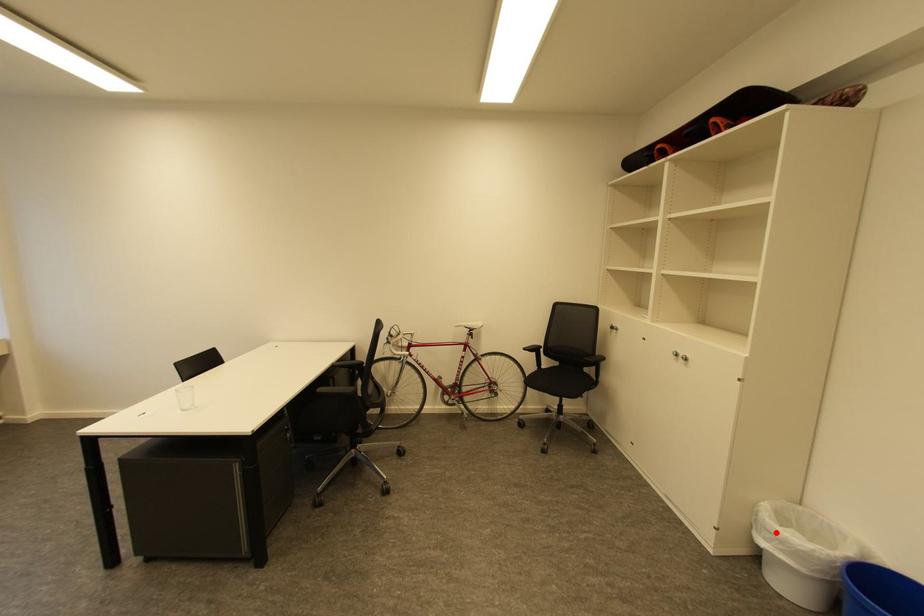
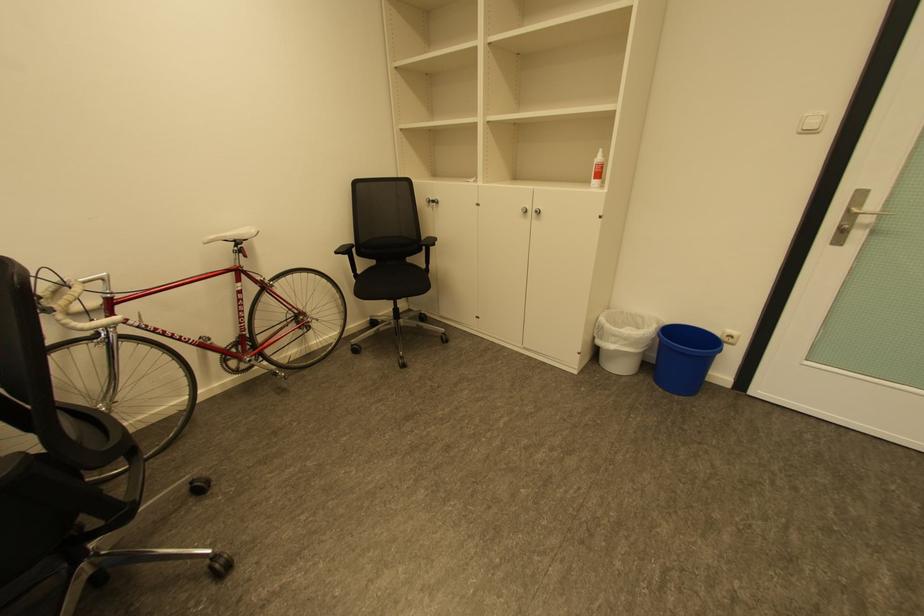
In the second image, find the point that corresponds to the highlighted location in the first image.

(622, 337)